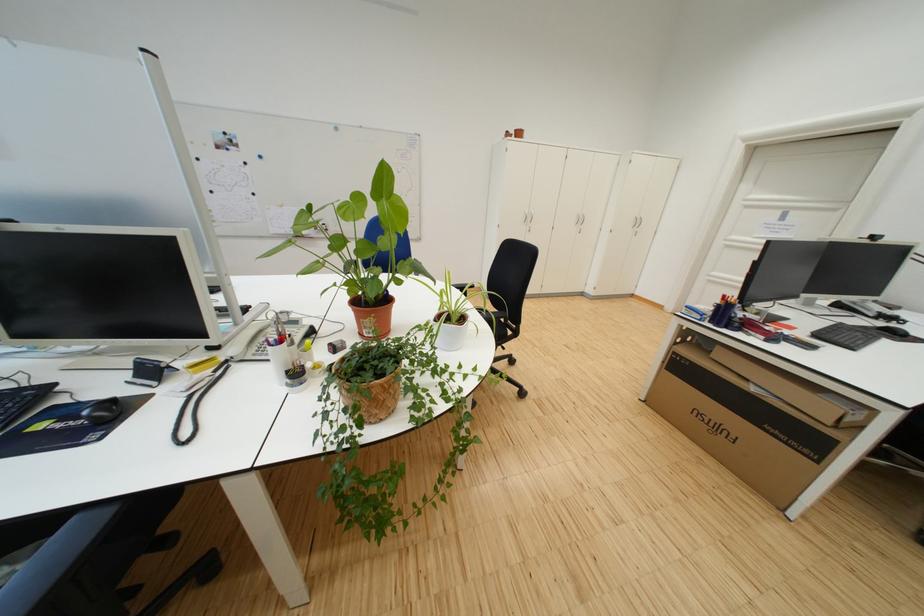
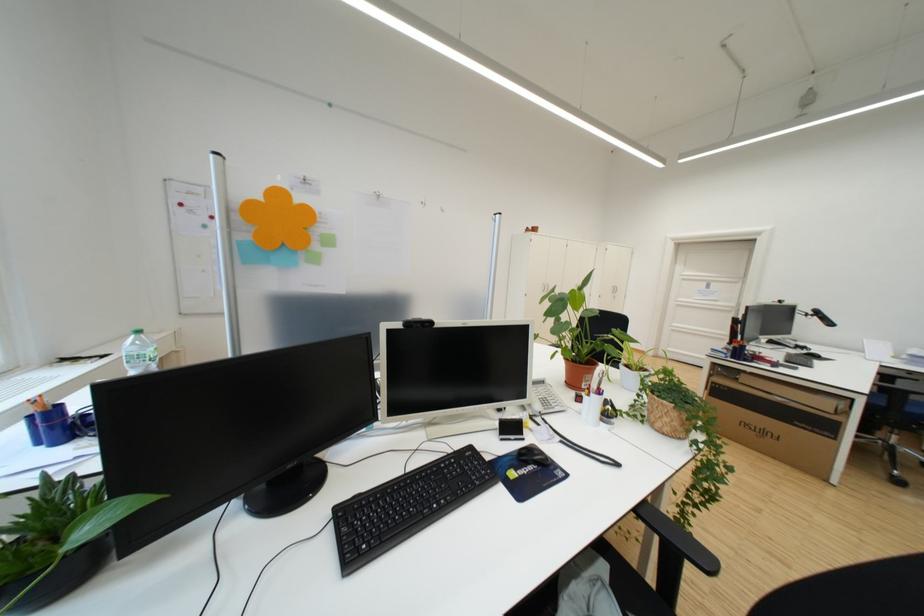
In the second image, find the point that corresponds to the point at 226,373 in the first image.

(551, 426)